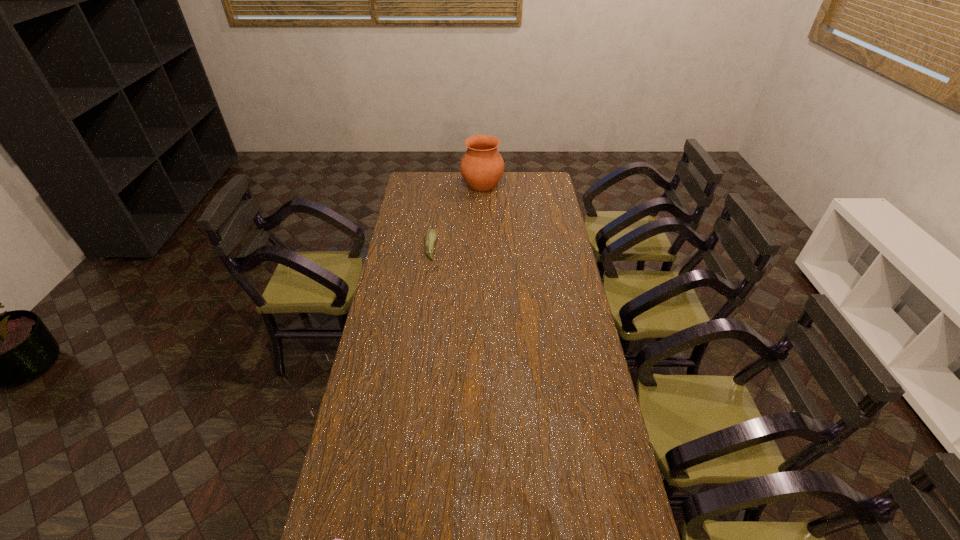
You are a GUI agent. You are given a task and a screenshot of the screen. Output one action in this format:
    pyautogui.click(x=<x>, y=<y>)
    Task: Click on the tallest object
    The width and height of the screenshot is (960, 540).
    Given the screenshot: What is the action you would take?
    pyautogui.click(x=482, y=166)

At what (x,y) coordinates should I click in order to perform the action: click on the farthest object. Please return your answer as a coordinate pair (x, y). This screenshot has height=540, width=960. Looking at the image, I should click on (482, 166).

Find the location of a particular element. The image size is (960, 540). the second shortest object is located at coordinates (431, 235).

Image resolution: width=960 pixels, height=540 pixels. Find the location of `zucchini`. zucchini is located at coordinates (431, 235).

The image size is (960, 540). I want to click on vacant area situated on the left of the tallest object, so click(x=446, y=183).

Locate an element on the screen. This screenshot has width=960, height=540. free location located at the stem end of the zucchini is located at coordinates (465, 248).

Find the location of a particular element. object that is positioned at the far edge is located at coordinates (x=482, y=166).

The width and height of the screenshot is (960, 540). Find the location of `object at the left edge`. object at the left edge is located at coordinates (431, 235).

In the image, there is a desktop. Identify the location of free region at the far edge. (444, 177).

You are a GUI agent. You are given a task and a screenshot of the screen. Output one action in this format:
    pyautogui.click(x=<x>, y=<y>)
    Task: Click on the vacant point at the left edge
    
    Given the screenshot: What is the action you would take?
    pyautogui.click(x=397, y=423)